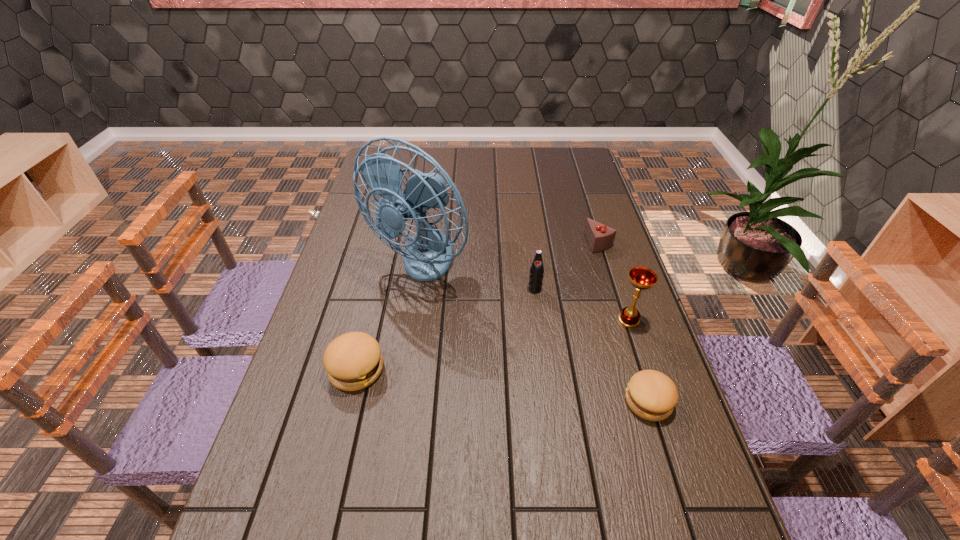
You are a GUI agent. You are given a task and a screenshot of the screen. Output one action in this format:
    pyautogui.click(x=<x>, y=<y>)
    Task: Click on the left hamburger
    
    Given the screenshot: What is the action you would take?
    pyautogui.click(x=353, y=361)

Find the location of `the shorter hamburger`. the shorter hamburger is located at coordinates (650, 394).

Find the location of a particular element. the third object from left to right is located at coordinates (536, 271).

The height and width of the screenshot is (540, 960). Find the location of `the fourth shortest object`. the fourth shortest object is located at coordinates (536, 271).

Locate an element on the screen. fan is located at coordinates (428, 255).

Where is `chocolate cake`? The image size is (960, 540). chocolate cake is located at coordinates (600, 237).

Identify the location of the third nearest object. This screenshot has width=960, height=540. (642, 278).

I want to click on vacant space located on the right of the left hamburger, so click(x=413, y=369).

Find the location of a particular element. This screenshot has width=960, height=540. free space located 0.140m on the front of the shorter hamburger is located at coordinates (676, 488).

The width and height of the screenshot is (960, 540). Find the location of `free space located 0.350m on the front label of the fourth shortest object`. free space located 0.350m on the front label of the fourth shortest object is located at coordinates (549, 401).